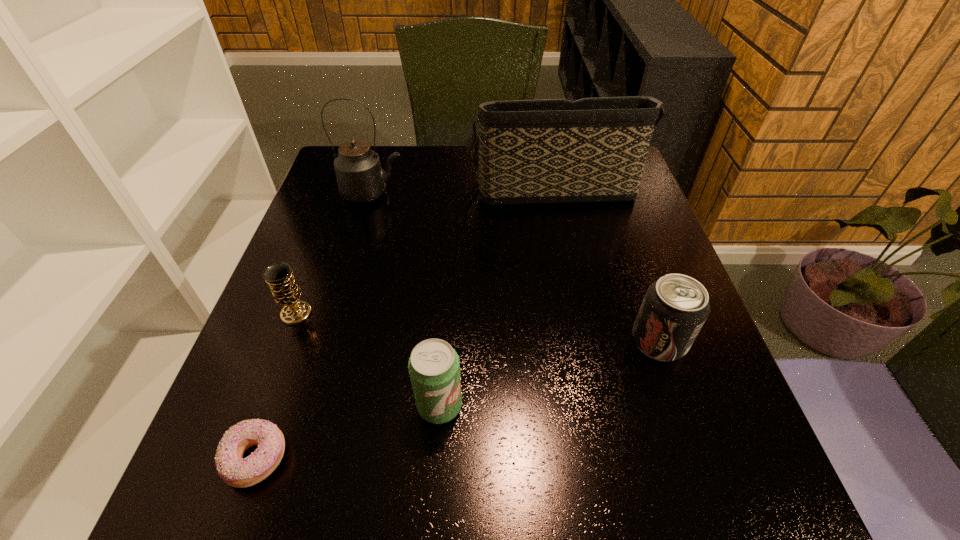
I want to click on free space located 0.380m on the back of the second shortest object, so click(x=341, y=193).

The width and height of the screenshot is (960, 540). Identify the location of vacant space positioned 0.330m on the back of the doughnut. (319, 280).

Identify the location of kettle present at the far edge. The image size is (960, 540). (360, 178).

I want to click on handbag present at the far edge, so click(547, 151).

This screenshot has height=540, width=960. Identify the location of object located in the near edge section of the desktop. (236, 471).

Locate an element on the screen. The image size is (960, 540). kettle that is at the left edge is located at coordinates (360, 178).

Locate an element on the screen. chalice at the left edge is located at coordinates (279, 276).

Identify the location of doughnut that is at the left edge. (236, 471).

Where is `handbag located in the right edge section of the desktop`? The width and height of the screenshot is (960, 540). handbag located in the right edge section of the desktop is located at coordinates (547, 151).

This screenshot has width=960, height=540. Identify the location of soda can at the right edge. (675, 307).